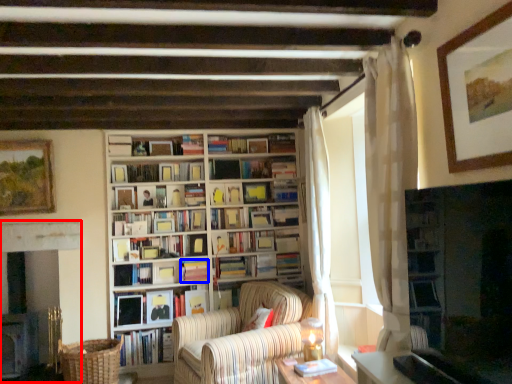
Question: Which object appears farthest to the camera in this image, fireplace (highlighted by a red box) or book (highlighted by a blue box)?

Choices:
 (A) fireplace
 (B) book

Answer: (B)